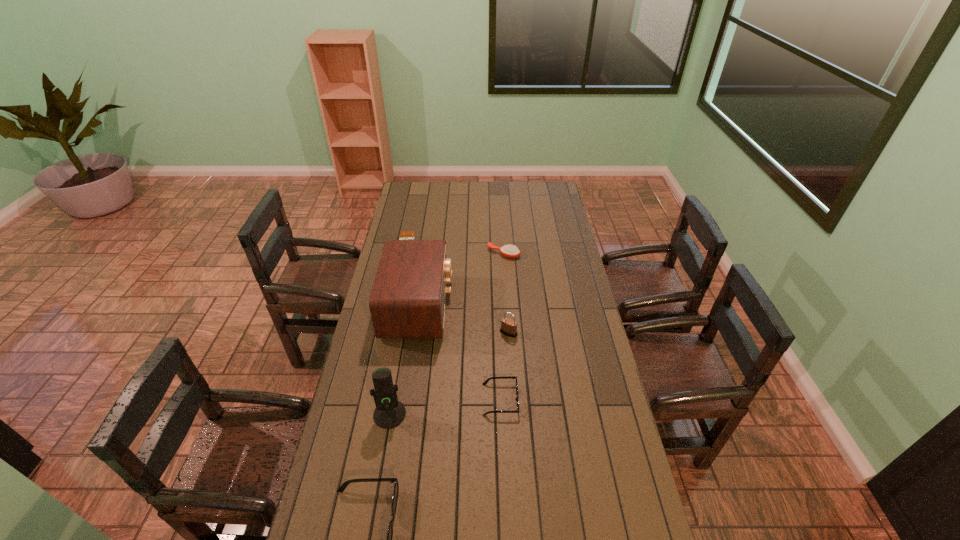
This screenshot has width=960, height=540. I want to click on vacant space located on the back of the hairbrush, so click(502, 230).

This screenshot has width=960, height=540. Identify the location of free region located on the front panel of the radio receiver. (480, 307).

Identify the location of free space located 0.340m on the back of the third tallest object. This screenshot has width=960, height=540. (505, 273).

What are the coordinates of `chocolate bar situated at the left edge` in the screenshot? It's located at (410, 235).

Image resolution: width=960 pixels, height=540 pixels. I want to click on microphone at the left edge, so click(389, 413).

At what (x,y) coordinates should I click in order to perform the action: click on radio receiver that is at the left edge. Please return your answer as a coordinate pair (x, y). The width and height of the screenshot is (960, 540). Looking at the image, I should click on (407, 300).

Image resolution: width=960 pixels, height=540 pixels. In order to click on free region at the far edge of the desktop in this screenshot , I will do `click(496, 186)`.

This screenshot has height=540, width=960. In the image, there is a desktop. Find the location of `blank space at the left edge`. blank space at the left edge is located at coordinates (383, 346).

You are a GUI agent. You are given a task and a screenshot of the screen. Output one action in this format:
    pyautogui.click(x=<x>, y=<y>)
    Task: Click on the vacant space at the right edge
    The image size is (960, 540).
    Given the screenshot: What is the action you would take?
    pyautogui.click(x=588, y=317)

You are a GUI agent. You are given a task and a screenshot of the screen. Output one action in this format:
    pyautogui.click(x=<x>, y=<y>)
    Task: Click on the blank space at the far left corner
    Image resolution: width=960 pixels, height=540 pixels.
    Given the screenshot: What is the action you would take?
    pyautogui.click(x=417, y=195)